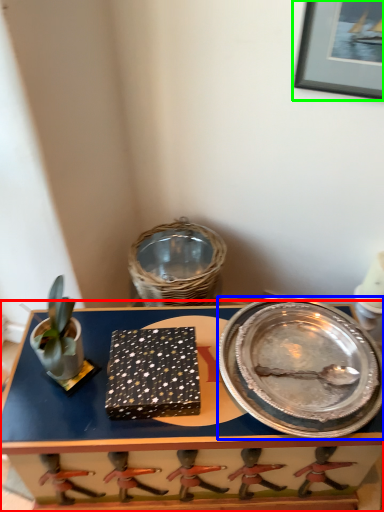
Question: Which object is positioned closest to table (highlighted by a red box)? Select from platter (highlighted by a blue box) and picture frame (highlighted by a green box).

Choices:
 (A) platter
 (B) picture frame

Answer: (A)